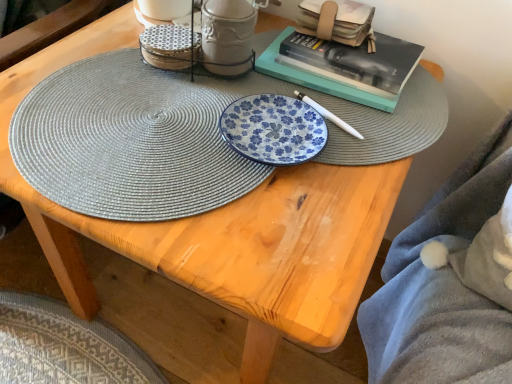
I want to click on vacant space to the right of porcelain textured coasters at upper center, marked as the 2th tableware in a right-to-left arrangement, so click(x=274, y=74).